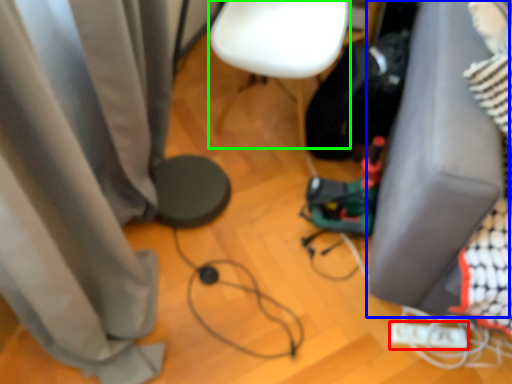
Question: Which object is the closest to the Wii controller (highlighted by a red box)? Choose among these: furniture (highlighted by a blue box) or armchair (highlighted by a green box).

Choices:
 (A) furniture
 (B) armchair

Answer: (A)